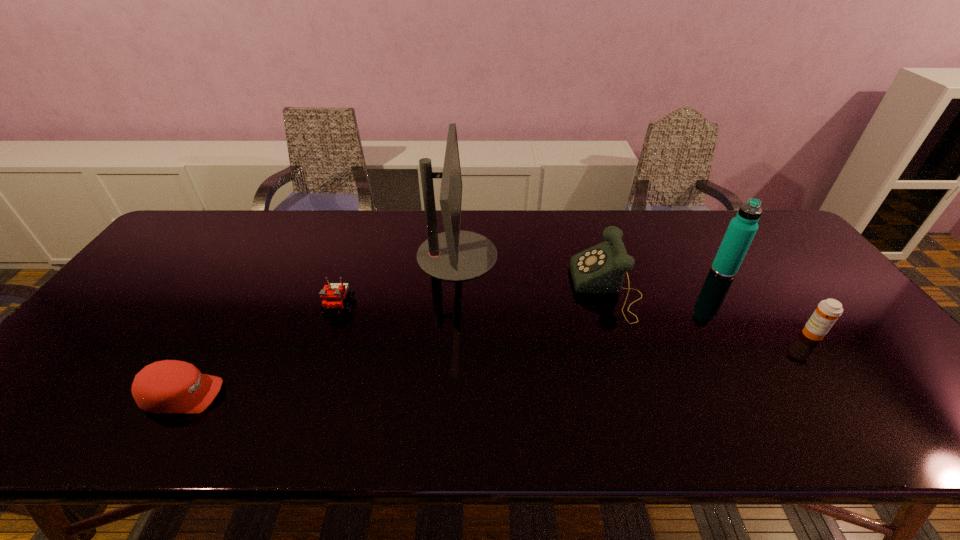
This screenshot has width=960, height=540. I want to click on vacant point that satisfies the following two spatial constraints: 1. on the screen of the fifth shortest object; 2. on the right side of the tallest object, so click(x=456, y=271).

Locate an element on the screen. blank area in the image that satisfies the following two spatial constraints: 1. on the dial of the telephone; 2. on the front-facing side of the Lego is located at coordinates (612, 307).

What are the coordinates of `free point that satisfies the following two spatial constraints: 1. on the dial of the fourth object from left to right; 2. on the left side of the third shortest object` in the screenshot? It's located at (621, 334).